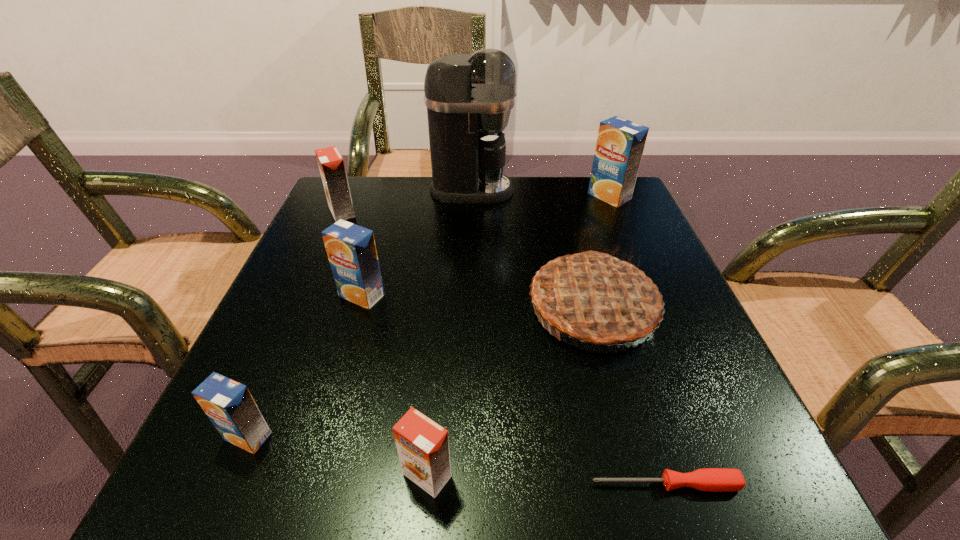
Where is `free space between the third object from left to right and the rightmost orange juice`? This screenshot has width=960, height=540. free space between the third object from left to right and the rightmost orange juice is located at coordinates pos(486,246).

Locate an element on the screen. vacant region between the tallest orange juice and the sixth object from right to left is located at coordinates (486, 246).

Find the location of a particular element. The height and width of the screenshot is (540, 960). vacant area that lies between the farthest blue orange_juice and the bigger orange orange juice is located at coordinates tap(475, 204).

Identify the location of vacant region between the leftmost blue orange_juice and the biggest blue orange_juice. (429, 316).

Find the location of a particular element. empty location between the second nearest blue orange_juice and the shortest object is located at coordinates (514, 390).

Image resolution: width=960 pixels, height=540 pixels. What are the coordinates of `free area in between the coffee maker and the right orange orange juice` in the screenshot? It's located at (449, 333).

The image size is (960, 540). Identify the location of object that is the fourth nearest to the smallest blue orange_juice. (708, 479).

Image resolution: width=960 pixels, height=540 pixels. I want to click on the second closest object to the shortest object, so click(x=594, y=297).

Identify which orange juice is located as the third nearest to the second biggest blue orange_juice. Please provide its 2D coordinates. Your answer should be formatted as a tuple, i.e. [(x, y)], where the tuple contains the x and y coordinates of a point satisfying the conditions above.

[(423, 446)]

Choose which orange juice is the second nearest neighbor to the tallest object. Please provide its 2D coordinates. Your answer should be formatted as a tuple, i.e. [(x, y)], where the tuple contains the x and y coordinates of a point satisfying the conditions above.

[(620, 144)]